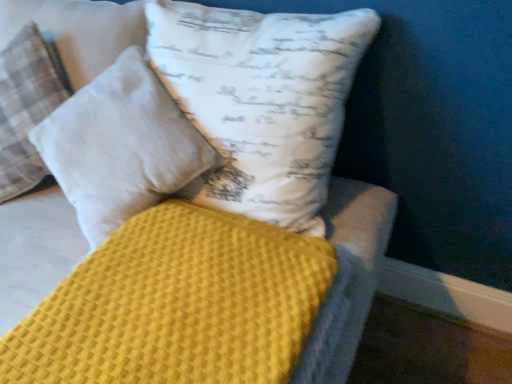
Question: Is the surface of yellow waffle-textured mattress at center in direct contact with white cotton pillow at upper center, which is counted as the 1th pillow, starting from the right?

Choices:
 (A) yes
 (B) no

Answer: (B)

Question: Can you confirm if yellow waffle-textured mattress at center is positioned to the left of white cotton pillow at upper center, which is counted as the second pillow, starting from the left?

Choices:
 (A) yes
 (B) no

Answer: (B)

Question: Is yellow waffle-textured mattress at center closer to the viewer compared to white cotton pillow at upper center, which is counted as the 1th pillow, starting from the right?

Choices:
 (A) yes
 (B) no

Answer: (A)

Question: Does yellow waffle-textured mattress at center have a lesser height compared to white cotton pillow at upper center, which is counted as the 1th pillow, starting from the right?

Choices:
 (A) no
 (B) yes

Answer: (B)

Question: Can you confirm if yellow waffle-textured mattress at center is wider than white cotton pillow at upper center, which is counted as the second pillow, starting from the left?

Choices:
 (A) no
 (B) yes

Answer: (B)

Question: From the image's perspective, is yellow waffle-textured mattress at center positioned above or below white cotton pillow at upper left, the second pillow viewed from the right?

Choices:
 (A) below
 (B) above

Answer: (A)

Question: From a real-world perspective, is yellow waffle-textured mattress at center physically located above or below white cotton pillow at upper left, placed as the first pillow when sorted from left to right?

Choices:
 (A) below
 (B) above

Answer: (A)

Question: Based on their sizes in the image, would you say yellow waffle-textured mattress at center is bigger or smaller than white cotton pillow at upper left, placed as the first pillow when sorted from left to right?

Choices:
 (A) small
 (B) big

Answer: (A)

Question: Is yellow waffle-textured mattress at center inside the boundaries of white cotton pillow at upper left, the second pillow viewed from the right, or outside?

Choices:
 (A) outside
 (B) inside

Answer: (A)

Question: Visually, is yellow waffle-textured mattress at center positioned to the left or to the right of white cotton pillow at upper center, which is counted as the 1th pillow, starting from the right?

Choices:
 (A) right
 (B) left

Answer: (A)

Question: Is yellow waffle-textured mattress at center taller or shorter than white cotton pillow at upper center, which is counted as the 1th pillow, starting from the right?

Choices:
 (A) tall
 (B) short

Answer: (B)

Question: Relative to white cotton pillow at upper center, which is counted as the 1th pillow, starting from the right, is yellow waffle-textured mattress at center in front or behind?

Choices:
 (A) behind
 (B) front

Answer: (B)

Question: In terms of size, does yellow waffle-textured mattress at center appear bigger or smaller than white cotton pillow at upper center, which is counted as the 1th pillow, starting from the right?

Choices:
 (A) big
 (B) small

Answer: (B)

Question: Is white cotton pillow at upper center, which is counted as the second pillow, starting from the left, wider or thinner than yellow waffle-textured mattress at center?

Choices:
 (A) wide
 (B) thin

Answer: (B)

Question: Looking at the image, does white cotton pillow at upper center, which is counted as the second pillow, starting from the left, seem bigger or smaller compared to yellow waffle-textured mattress at center?

Choices:
 (A) small
 (B) big

Answer: (B)